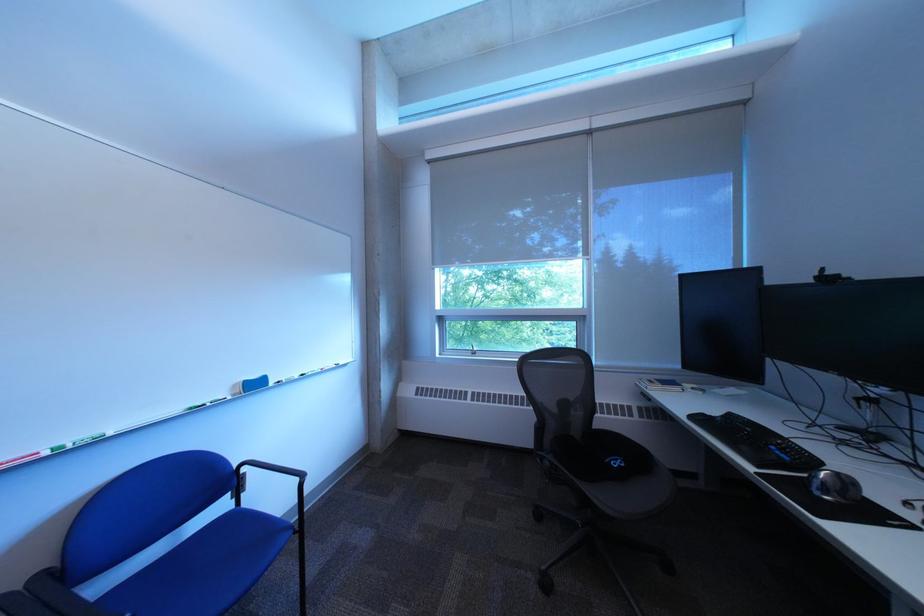
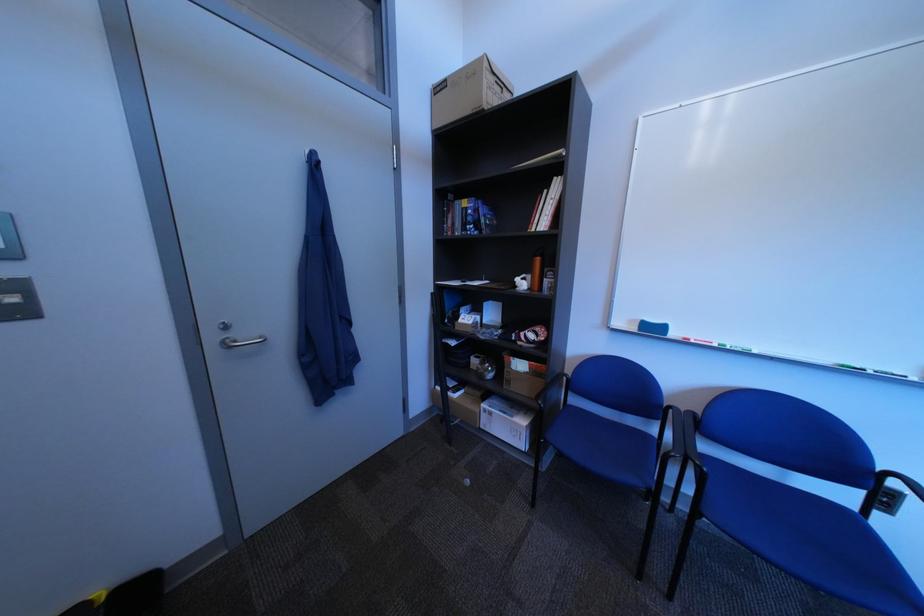
Locate, in the second image, the point that corresponds to (259,493) in the first image.

(906, 516)